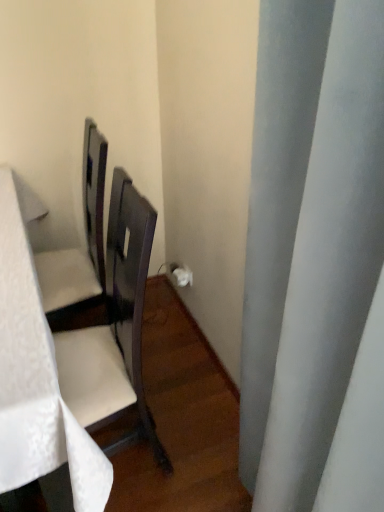
Where is `white fabric table at left`? The image size is (384, 512). white fabric table at left is located at coordinates (36, 379).

Describe the element at coordinates (36, 379) in the screenshot. This screenshot has width=384, height=512. I see `white fabric table at left` at that location.

This screenshot has width=384, height=512. I want to click on white matte curtain at right, so click(316, 261).

What do you see at coordinates (316, 261) in the screenshot? The image size is (384, 512). I see `white matte curtain at right` at bounding box center [316, 261].

Locate an element on the screen. This screenshot has width=384, height=512. white fabric table at left is located at coordinates (36, 379).

Visually, is white matte curtain at right positioned to the left or to the right of white fabric table at left?

From the image, it's evident that white matte curtain at right is to the right of white fabric table at left.

Considering their positions, is white matte curtain at right located in front of or behind white fabric table at left?

In the image, white matte curtain at right appears in front of white fabric table at left.

Does point (352, 255) appear closer or farther from the camera than point (11, 385)?

Point (352, 255) appears to be closer to the viewer than point (11, 385).

From the image's perspective, is white matte curtain at right below white fabric table at left?

No, from the image's perspective, white matte curtain at right is not below white fabric table at left.

From a real-world perspective, is white matte curtain at right above or below white fabric table at left?

white matte curtain at right is above white fabric table at left.

Considering the sizes of objects white matte curtain at right and white fabric table at left in the image provided, who is thinner, white matte curtain at right or white fabric table at left?

Thinner between the two is white matte curtain at right.

Can you confirm if white matte curtain at right is taller than white fabric table at left?

Correct, white matte curtain at right is much taller as white fabric table at left.

Looking at the image, does white matte curtain at right seem bigger or smaller compared to white fabric table at left?

Considering their sizes, white matte curtain at right takes up less space than white fabric table at left.

Which is correct: white matte curtain at right is inside white fabric table at left, or outside of it?

white matte curtain at right is located beyond the bounds of white fabric table at left.

Is white matte curtain at right far away from white fabric table at left?

Actually, white matte curtain at right and white fabric table at left are a little close together.

Is white fabric table at left at the back of white matte curtain at right?

No, white fabric table at left is not at the back of white matte curtain at right.

Find the location of a particular element. The width and height of the screenshot is (384, 512). table behind the white matte curtain at right is located at coordinates (36, 379).

Is white fabric table at left to the left or to the right of white matte curtain at right in the image?

From the image, it's evident that white fabric table at left is to the left of white matte curtain at right.

Is white fabric table at left positioned behind white matte curtain at right?

Yes, it is.

Is point (23, 361) less distant than point (291, 3)?

No, (23, 361) is further to viewer.

Looking at this image, from the image's perspective, which one is positioned higher, white fabric table at left or white matte curtain at right?

white matte curtain at right, from the image's perspective.

From a real-world perspective, is white fabric table at left on top of white matte curtain at right?

Incorrect, from a real-world perspective, white fabric table at left is lower than white matte curtain at right.

Which of these two, white fabric table at left or white matte curtain at right, is wider?

With larger width is white fabric table at left.

Considering the sizes of objects white fabric table at left and white matte curtain at right in the image provided, who is shorter, white fabric table at left or white matte curtain at right?

With less height is white fabric table at left.

Is white fabric table at left bigger or smaller than white matte curtain at right?

white fabric table at left is bigger than white matte curtain at right.

Is white fabric table at left inside the boundaries of white matte curtain at right, or outside?

white fabric table at left is not enclosed by white matte curtain at right.

Is white fabric table at left not close to white matte curtain at right?

No, white fabric table at left is not far from white matte curtain at right.

Is white fabric table at left oriented away from white matte curtain at right?

That's not correct — white fabric table at left is not looking away from white matte curtain at right.

How many degrees apart are the facing directions of white fabric table at left and white matte curtain at right?

The angle between the facing direction of white fabric table at left and the facing direction of white matte curtain at right is 89 degrees.

Identify the location of table that is below the white matte curtain at right (from the image's perspective). (x=36, y=379).

What are the coordinates of `curtain lying on the right of white fabric table at left` in the screenshot? It's located at [x=316, y=261].

This screenshot has width=384, height=512. In order to click on curtain above the white fabric table at left (from the image's perspective) in this screenshot , I will do `click(316, 261)`.